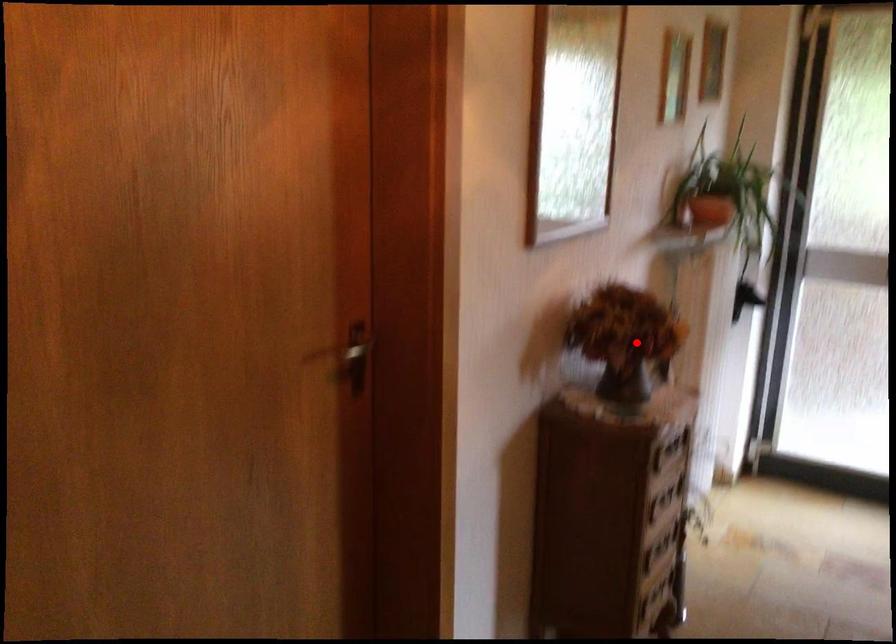
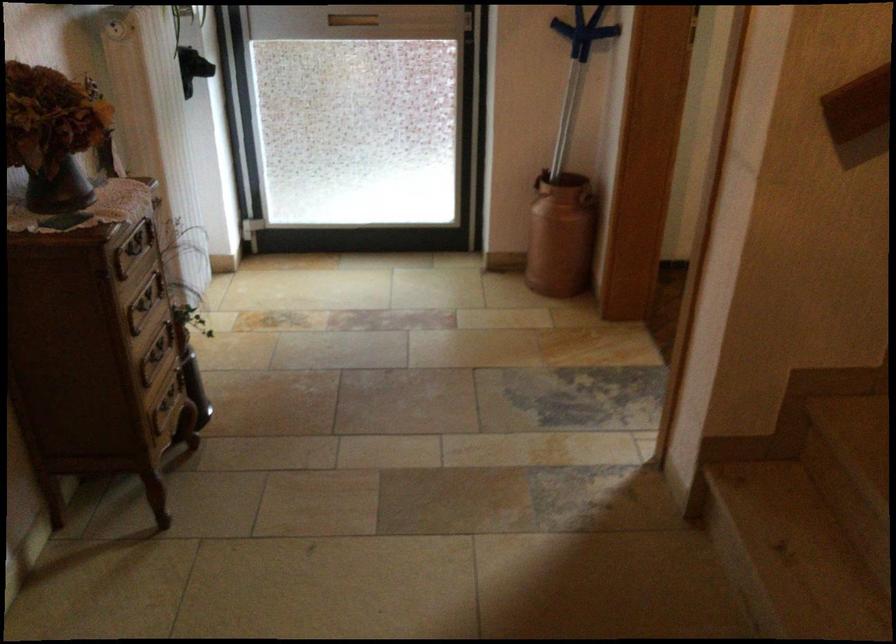
Question: I am providing you with two images of the same scene from different viewpoints. A red point is shown in image1. For the corresponding object point in image2, is it positioned nearer or farther from the camera?

Choices:
 (A) Nearer
 (B) Farther

Answer: (A)